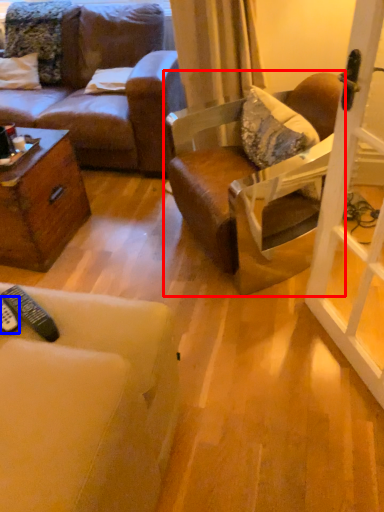
Question: Among these objects, which one is farthest to the camera, chair (highlighted by a red box) or remote control (highlighted by a blue box)?

Choices:
 (A) chair
 (B) remote control

Answer: (A)